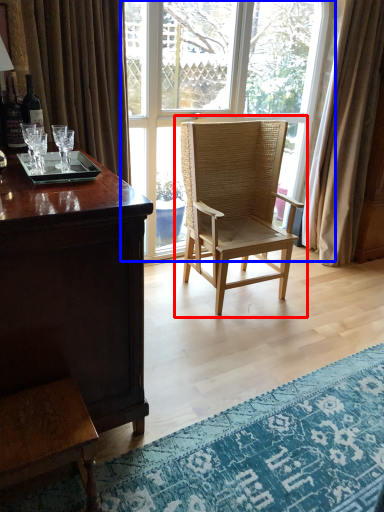
Question: Which point is further to the camera, chair (highlighted by a red box) or window (highlighted by a blue box)?

Choices:
 (A) chair
 (B) window

Answer: (B)